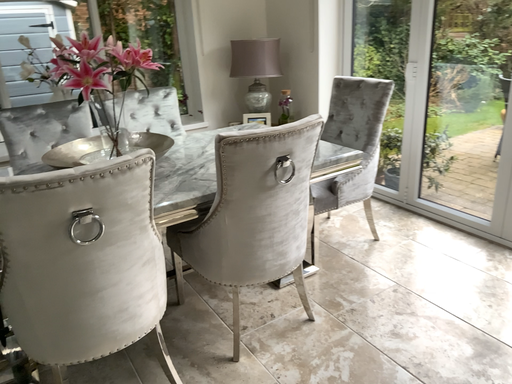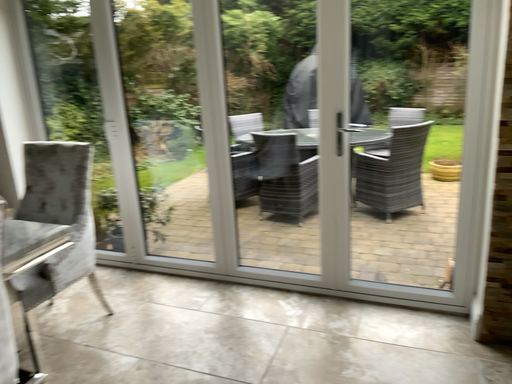
Question: Which way did the camera rotate in the video?

Choices:
 (A) rotated right
 (B) rotated left

Answer: (A)